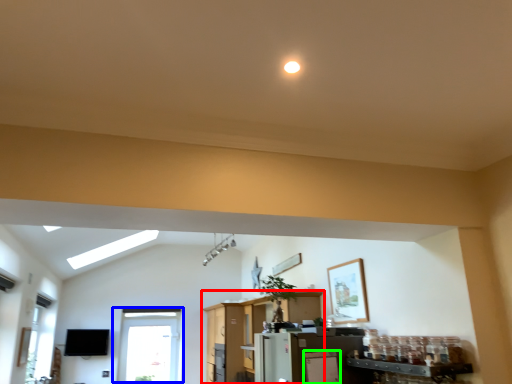
Question: Which is farther away from entertainment center (highlighted by a red box)? window (highlighted by a blue box) or appliance (highlighted by a green box)?

Choices:
 (A) window
 (B) appliance

Answer: (B)